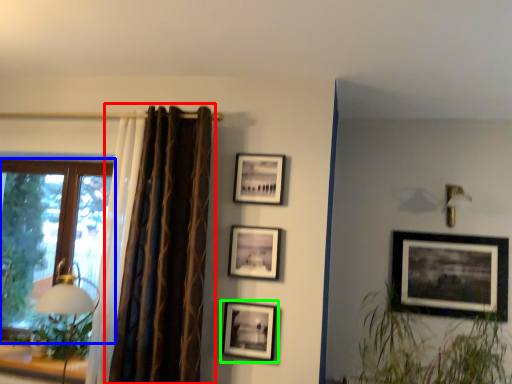
Question: Which is farther away from curtain (highlighted by a red box)? window (highlighted by a blue box) or picture frame (highlighted by a green box)?

Choices:
 (A) window
 (B) picture frame

Answer: (A)